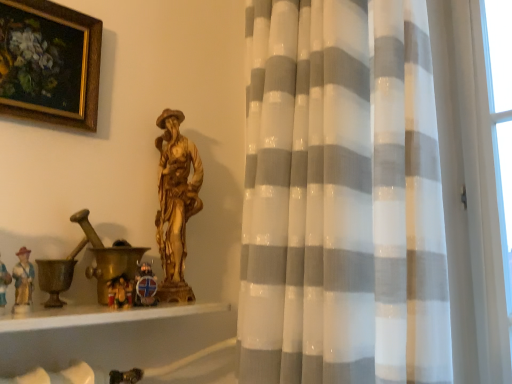
Question: Does white sheer curtain at center have a smaller size compared to gold-framed painting at upper left?

Choices:
 (A) yes
 (B) no

Answer: (B)

Question: Can you confirm if white sheer curtain at center is positioned to the left of gold-framed painting at upper left?

Choices:
 (A) no
 (B) yes

Answer: (A)

Question: Is the depth of white sheer curtain at center greater than that of gold-framed painting at upper left?

Choices:
 (A) yes
 (B) no

Answer: (B)

Question: Can you confirm if white sheer curtain at center is bigger than gold-framed painting at upper left?

Choices:
 (A) no
 (B) yes

Answer: (B)

Question: Is white sheer curtain at center turned away from gold-framed painting at upper left?

Choices:
 (A) yes
 (B) no

Answer: (B)

Question: Is point (2, 319) closer or farther from the camera than point (65, 67)?

Choices:
 (A) closer
 (B) farther

Answer: (A)

Question: From a real-world perspective, is white glossy wood at lower left positioned above or below gold-framed painting at upper left?

Choices:
 (A) above
 (B) below

Answer: (B)

Question: Based on their positions, is white glossy wood at lower left located to the left or right of gold-framed painting at upper left?

Choices:
 (A) left
 (B) right

Answer: (B)

Question: Considering the positions of white glossy wood at lower left and gold-framed painting at upper left in the image, is white glossy wood at lower left wider or thinner than gold-framed painting at upper left?

Choices:
 (A) thin
 (B) wide

Answer: (B)

Question: Visually, is white glossy wood at lower left positioned to the left or to the right of white sheer curtain at center?

Choices:
 (A) left
 (B) right

Answer: (A)

Question: Is point click(x=123, y=312) positioned closer to the camera than point click(x=480, y=322)?

Choices:
 (A) closer
 (B) farther

Answer: (A)

Question: From the image's perspective, is white glossy wood at lower left positioned above or below white sheer curtain at center?

Choices:
 (A) below
 (B) above

Answer: (A)

Question: Looking at the image, does white glossy wood at lower left seem bigger or smaller compared to white sheer curtain at center?

Choices:
 (A) big
 (B) small

Answer: (B)

Question: In terms of width, does white sheer curtain at center look wider or thinner when compared to gold-framed painting at upper left?

Choices:
 (A) wide
 (B) thin

Answer: (A)

Question: From the image's perspective, is white sheer curtain at center above or below gold-framed painting at upper left?

Choices:
 (A) below
 (B) above

Answer: (A)